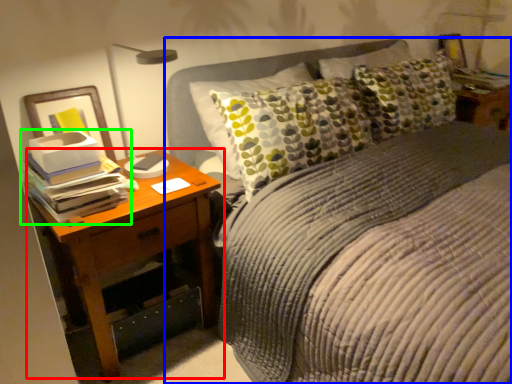
Question: Based on their relative distances, which object is nearer to nightstand (highlighted by a red box)? Choose from bed (highlighted by a blue box) and book (highlighted by a green box).

Choices:
 (A) bed
 (B) book

Answer: (B)